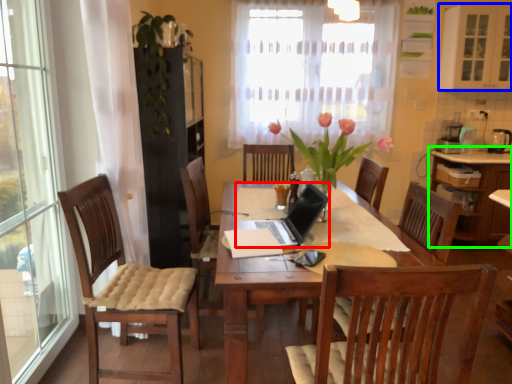
Question: Which object is positioned closest to laptop (highlighted by a red box)? Select from cabinetry (highlighted by a blue box) and cabinetry (highlighted by a green box).

Choices:
 (A) cabinetry
 (B) cabinetry

Answer: (B)